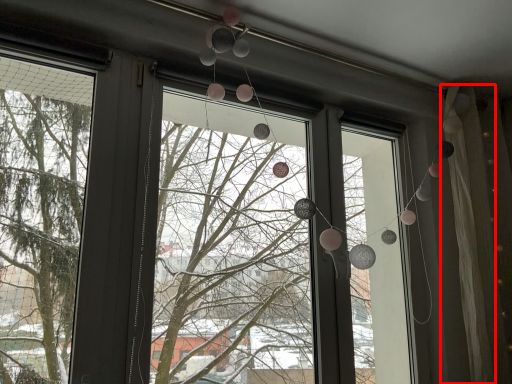
Question: From the image, what is the correct spatial relationship of curtain (annotated by the red box) in relation to shop window?

Choices:
 (A) left
 (B) right

Answer: (B)